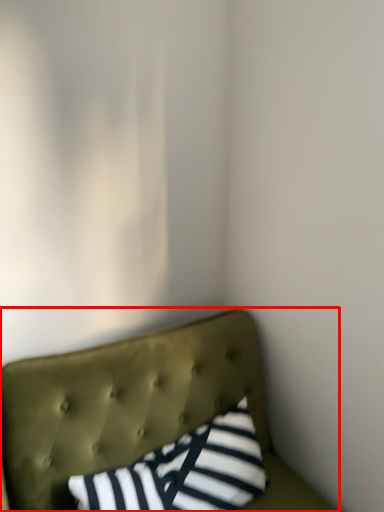
Question: Where is furniture (annotated by the red box) located in relation to pillow in the image?

Choices:
 (A) right
 (B) left

Answer: (A)